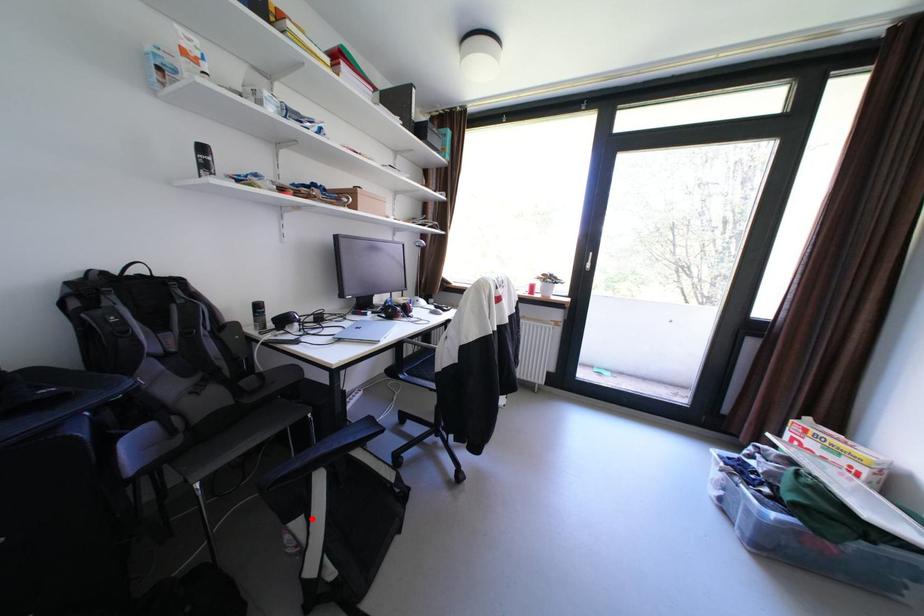
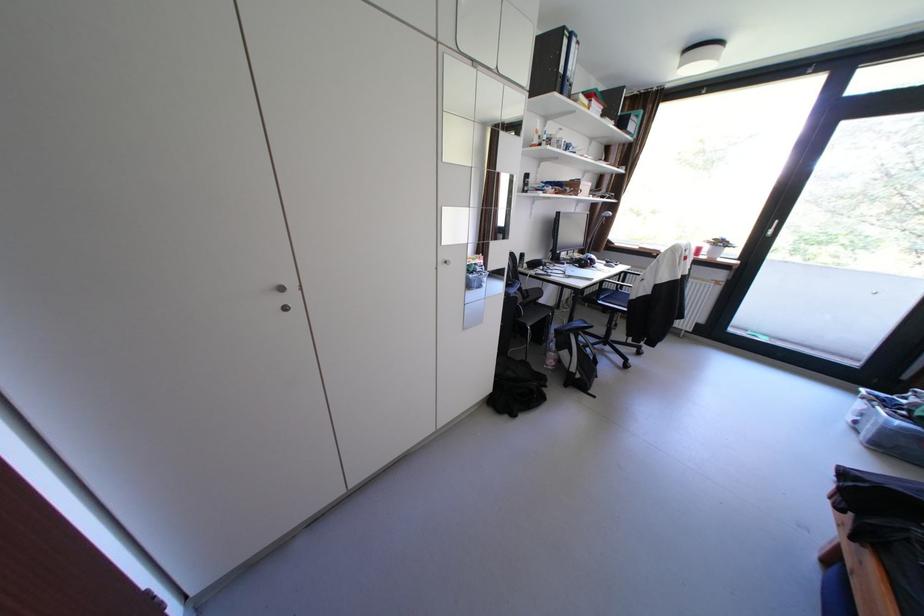
Where in the second image is the point corresponding to the highlighted location from the first image?

(578, 351)